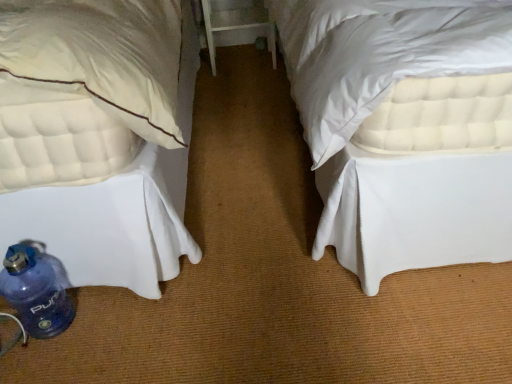
Question: In terms of size, does blue plastic water bottle at lower left appear bigger or smaller than white wood table at center?

Choices:
 (A) big
 (B) small

Answer: (B)

Question: From the image's perspective, is blue plastic water bottle at lower left located above or below white wood table at center?

Choices:
 (A) below
 (B) above

Answer: (A)

Question: Considering the real-world distances, which object is farthest from the white quilted mattress at lower left?

Choices:
 (A) white wood table at center
 (B) blue plastic water bottle at lower left

Answer: (A)

Question: Estimate the real-world distances between objects in this image. Which object is closer to the white wood table at center?

Choices:
 (A) blue plastic water bottle at lower left
 (B) white quilted mattress at lower left

Answer: (B)